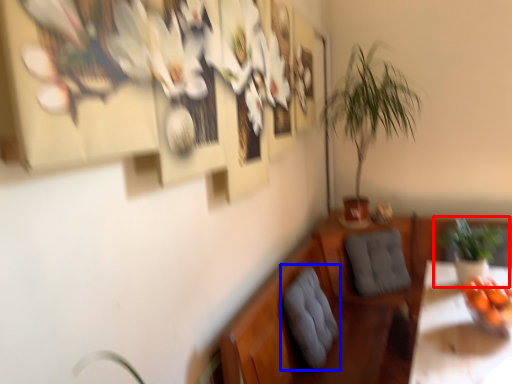
Question: Which point is further to the camera, houseplant (highlighted by a red box) or swivel chair (highlighted by a blue box)?

Choices:
 (A) houseplant
 (B) swivel chair

Answer: (A)